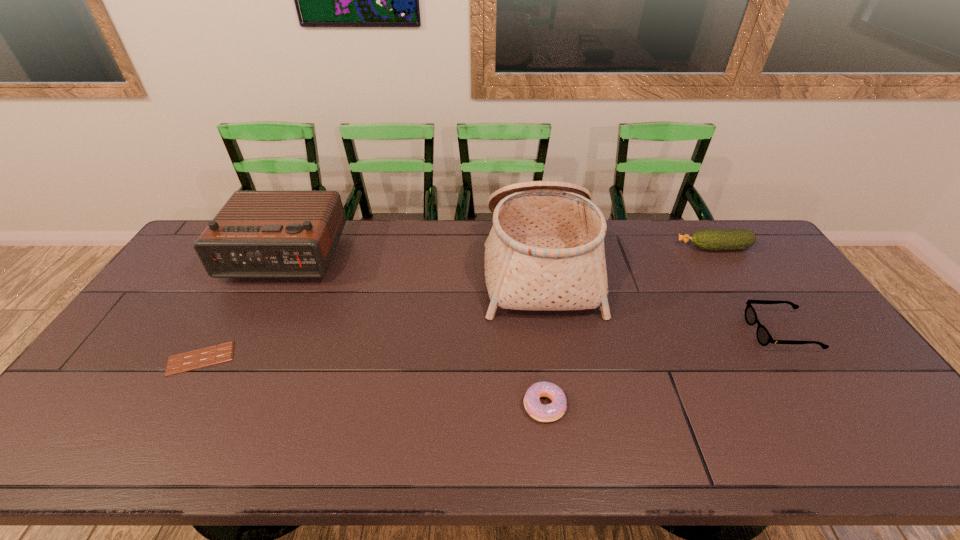
Locate an element on the screen. vacant space at the left edge is located at coordinates (198, 268).

At what (x,y) coordinates should I click in order to perform the action: click on free space at the right edge of the desktop. Please return your answer as a coordinate pair (x, y). The image size is (960, 540). Looking at the image, I should click on (753, 278).

The image size is (960, 540). In the image, there is a desktop. In order to click on free space at the far right corner in this screenshot , I will do `click(736, 227)`.

Where is `free point between the second shortest object and the radio receiver`? free point between the second shortest object and the radio receiver is located at coordinates (414, 331).

Find the location of a particular element. The width and height of the screenshot is (960, 540). free space between the fourth tallest object and the cucumber is located at coordinates (748, 290).

Image resolution: width=960 pixels, height=540 pixels. I want to click on free space that is in between the cucumber and the basket, so click(x=627, y=256).

Locate an element on the screen. This screenshot has width=960, height=540. free space that is in between the basket and the doughnut is located at coordinates (541, 335).

Identify the location of free spot between the fifth shortest object and the doughnut. coord(414,331).

Find the location of `empty space between the nearest object and the fourth shortest object`. empty space between the nearest object and the fourth shortest object is located at coordinates (629, 327).

Image resolution: width=960 pixels, height=540 pixels. Find the location of `vacant space that is in between the basket and the third shortest object`. vacant space that is in between the basket and the third shortest object is located at coordinates (660, 298).